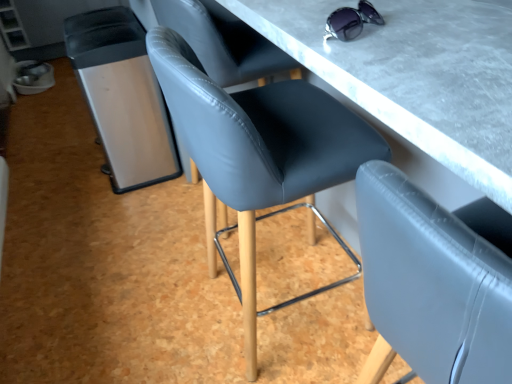
Identify the location of slate leather chair at center. Image resolution: width=512 pixels, height=384 pixels. (260, 153).

What do you see at coordinates (260, 153) in the screenshot? The width and height of the screenshot is (512, 384). I see `slate leather chair at center` at bounding box center [260, 153].

Where is `slate leather chair at center`? slate leather chair at center is located at coordinates (260, 153).